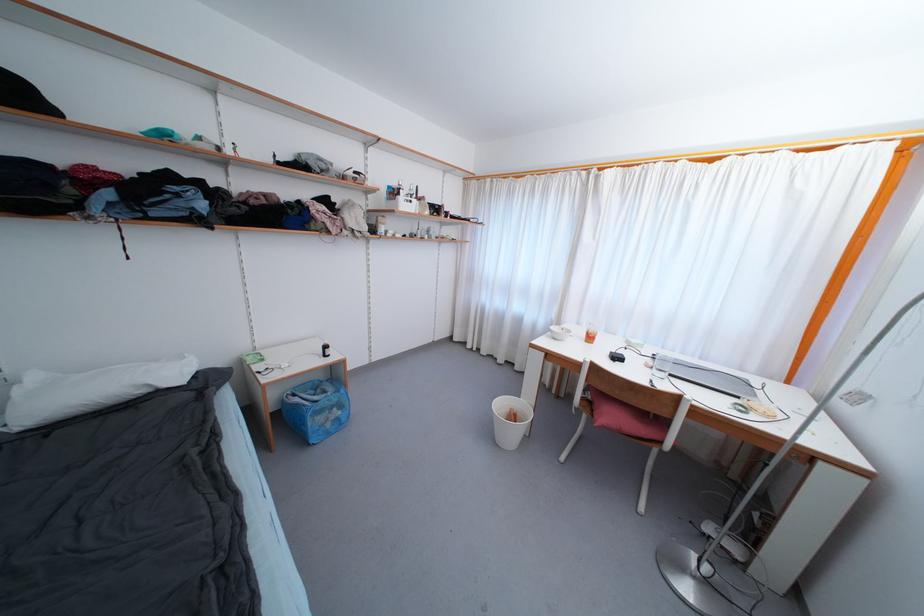
Find where to lift the clear drinking glass. Please return your answer as a coordinate pair (x, y).

(590, 333)